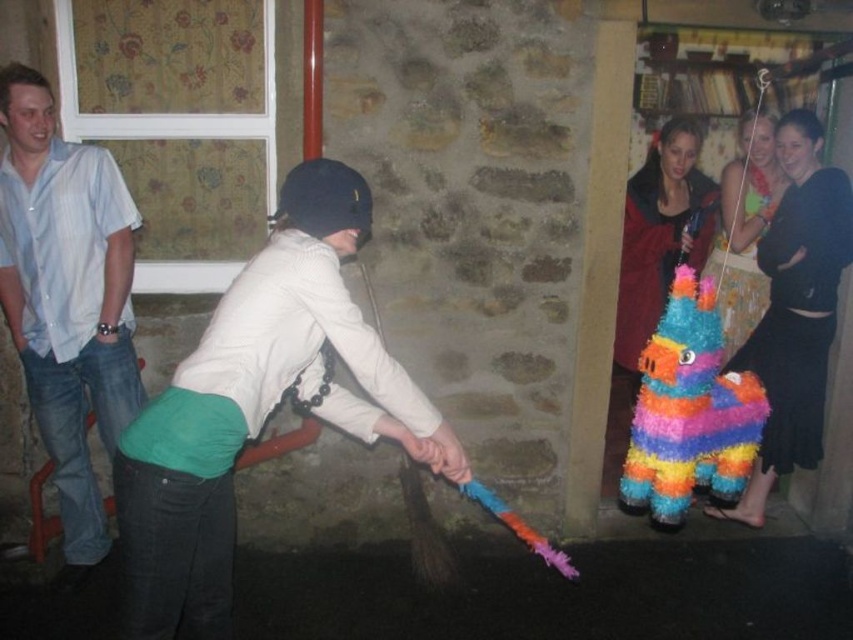
Question: Which point appears farthest from the camera in this image?

Choices:
 (A) (10, 118)
 (B) (303, 172)
 (C) (683, 392)

Answer: (A)

Question: Which of the following is the farthest from the observer?

Choices:
 (A) light blue striped shirt at left
 (B) white matte helmet at center
 (C) multicolored paper pinata at center

Answer: (A)

Question: Can you confirm if white matte helmet at center is positioned to the right of multicolored paper pinata at center?

Choices:
 (A) no
 (B) yes

Answer: (A)

Question: Based on their relative distances, which object is farther from the white matte helmet at center?

Choices:
 (A) multicolored paper pinata at center
 (B) light blue striped shirt at left

Answer: (B)

Question: Does white matte helmet at center appear under light blue striped shirt at left?

Choices:
 (A) no
 (B) yes

Answer: (B)

Question: Observing the image, what is the correct spatial positioning of white matte helmet at center in reference to multicolored paper pinata at center?

Choices:
 (A) right
 (B) left

Answer: (B)